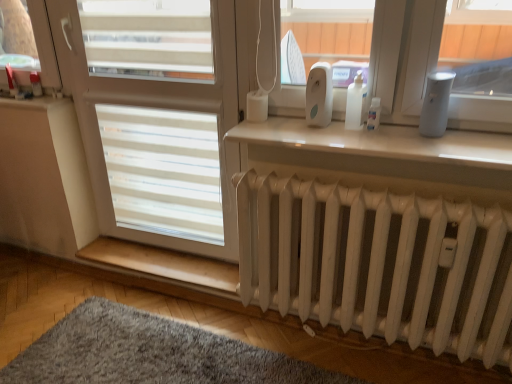
Question: Should I look upward or downward to see gray fluffy rug at lower left?

Choices:
 (A) down
 (B) up

Answer: (A)

Question: Is light brown wood at lower center next to white matte screen door at center and touching it?

Choices:
 (A) no
 (B) yes

Answer: (A)

Question: Considering the relative sizes of light brown wood at lower center and white matte screen door at center in the image provided, is light brown wood at lower center thinner than white matte screen door at center?

Choices:
 (A) yes
 (B) no

Answer: (B)

Question: Considering the relative sizes of light brown wood at lower center and white matte screen door at center in the image provided, is light brown wood at lower center taller than white matte screen door at center?

Choices:
 (A) no
 (B) yes

Answer: (A)

Question: Is light brown wood at lower center closer to camera compared to white matte screen door at center?

Choices:
 (A) no
 (B) yes

Answer: (A)

Question: Is light brown wood at lower center at the right side of white matte screen door at center?

Choices:
 (A) yes
 (B) no

Answer: (B)

Question: Is the position of light brown wood at lower center more distant than that of white matte screen door at center?

Choices:
 (A) yes
 (B) no

Answer: (A)

Question: Is white matte radiator at lower center smaller than gray fluffy rug at lower left?

Choices:
 (A) no
 (B) yes

Answer: (A)

Question: From the image's perspective, is white matte radiator at lower center on gray fluffy rug at lower left?

Choices:
 (A) yes
 (B) no

Answer: (A)

Question: From a real-world perspective, is white matte radiator at lower center over gray fluffy rug at lower left?

Choices:
 (A) yes
 (B) no

Answer: (A)

Question: From the image's perspective, does white matte radiator at lower center appear lower than gray fluffy rug at lower left?

Choices:
 (A) no
 (B) yes

Answer: (A)

Question: Does white matte radiator at lower center have a greater height compared to gray fluffy rug at lower left?

Choices:
 (A) yes
 (B) no

Answer: (A)

Question: Is the surface of white matte radiator at lower center in direct contact with gray fluffy rug at lower left?

Choices:
 (A) no
 (B) yes

Answer: (A)

Question: From the image's perspective, is white plastic device at upper center over white matte screen door at center?

Choices:
 (A) yes
 (B) no

Answer: (A)